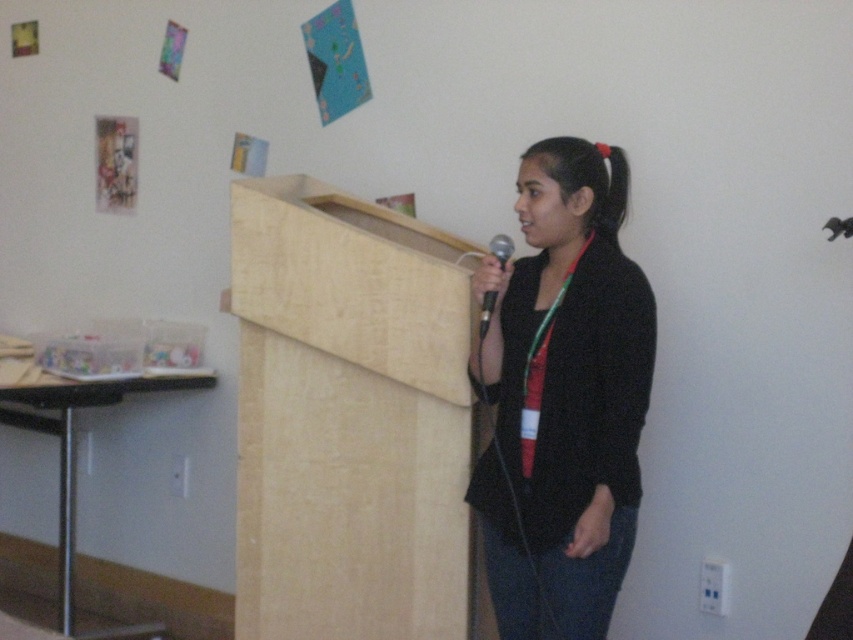
Question: Among these objects, which one is farthest from the camera?

Choices:
 (A) black matte jacket at center
 (B) metallic silver microphone at center
 (C) light wood podium at center

Answer: (C)

Question: Is light wood podium at center positioned at the back of brown wood podium at lower left?

Choices:
 (A) yes
 (B) no

Answer: (B)

Question: Is light wood podium at center to the right of black matte jacket at center from the viewer's perspective?

Choices:
 (A) no
 (B) yes

Answer: (A)

Question: Which of these objects is positioned closest to the metallic silver microphone at center?

Choices:
 (A) black matte jacket at center
 (B) light wood podium at center
 (C) brown wood podium at lower left

Answer: (A)

Question: Which of the following is the closest to the observer?

Choices:
 (A) light wood podium at center
 (B) black matte jacket at center
 (C) brown wood podium at lower left
 (D) metallic silver microphone at center

Answer: (B)

Question: Does light wood podium at center appear on the left side of brown wood podium at lower left?

Choices:
 (A) no
 (B) yes

Answer: (A)